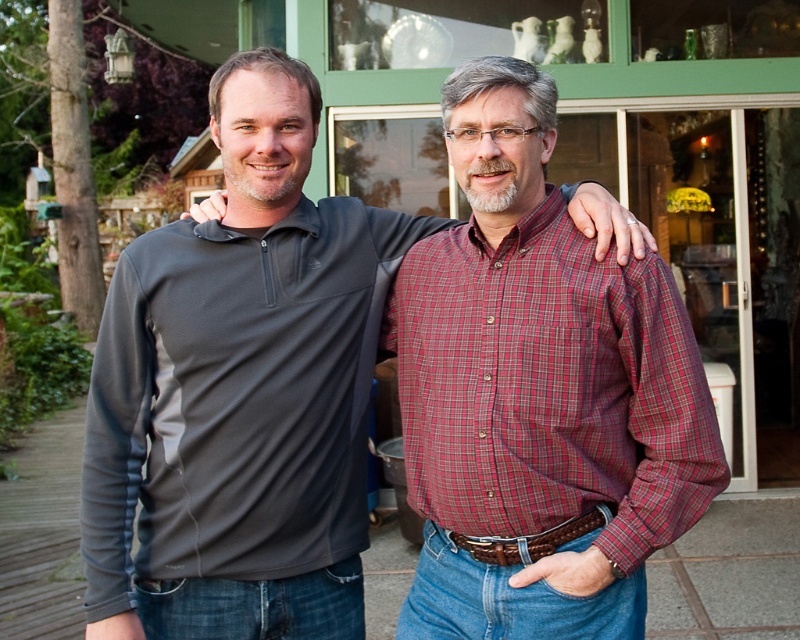
You are trying to determine the clothing layers of the person on the right. Based on the image, which item is visible on top, the plaid cotton shirt at center or the brown leather belt at center?

The plaid cotton shirt at center is positioned over the brown leather belt at center, so the plaid cotton shirt at center is visible on top.

You are a photographer trying to capture a closeup of the gray fleece pullover at center and the plaid cotton shirt at center. Since you want both items in focus, you need to know their positions relative to each other. Which one is positioned to the left side of the other?

The gray fleece pullover at center is to the left of the plaid cotton shirt at center.